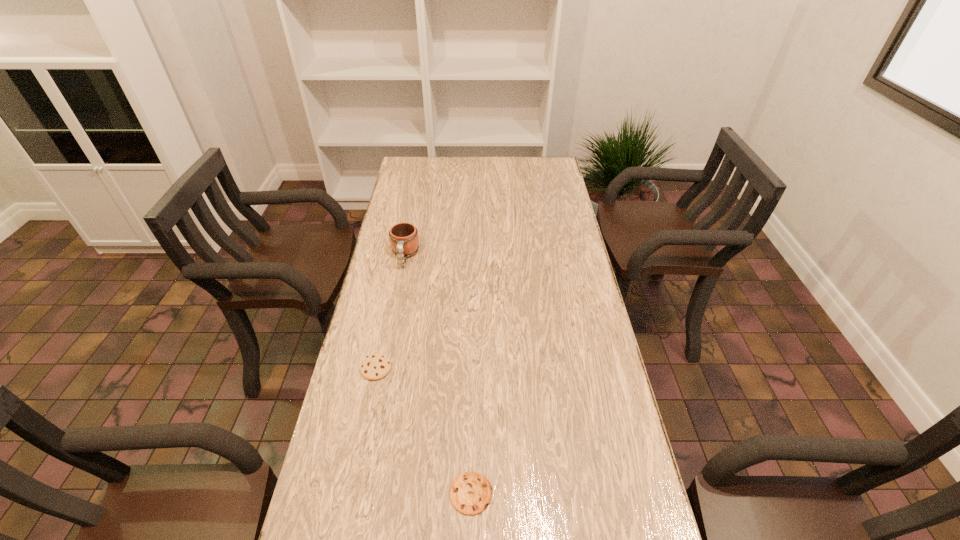
At what (x,y) coordinates should I click in order to perform the action: click on cookie at the left edge. Please return your answer as a coordinate pair (x, y). The height and width of the screenshot is (540, 960). Looking at the image, I should click on (376, 366).

Find the location of a particular element. vacant area at the far edge of the desktop is located at coordinates (457, 175).

Find the location of a particular element. The image size is (960, 540). vacant position at the left edge of the desktop is located at coordinates (360, 394).

Where is `vacant space at the right edge of the desktop`? vacant space at the right edge of the desktop is located at coordinates (543, 210).

Find the location of a particular element. The width and height of the screenshot is (960, 540). vacant space at the far right corner is located at coordinates (545, 163).

Identify the location of vacant space in between the left cookie and the mug. This screenshot has width=960, height=540. (391, 312).

Where is `free space between the tallest object and the farther cookie`? free space between the tallest object and the farther cookie is located at coordinates (391, 312).

Find the location of `empty location between the tallest object and the second farthest object`. empty location between the tallest object and the second farthest object is located at coordinates (391, 312).

Identify the location of unoccupied area between the nearest object and the mug. The width and height of the screenshot is (960, 540). (438, 375).

Locate an element on the screen. free space between the nearest object and the farther cookie is located at coordinates (423, 431).